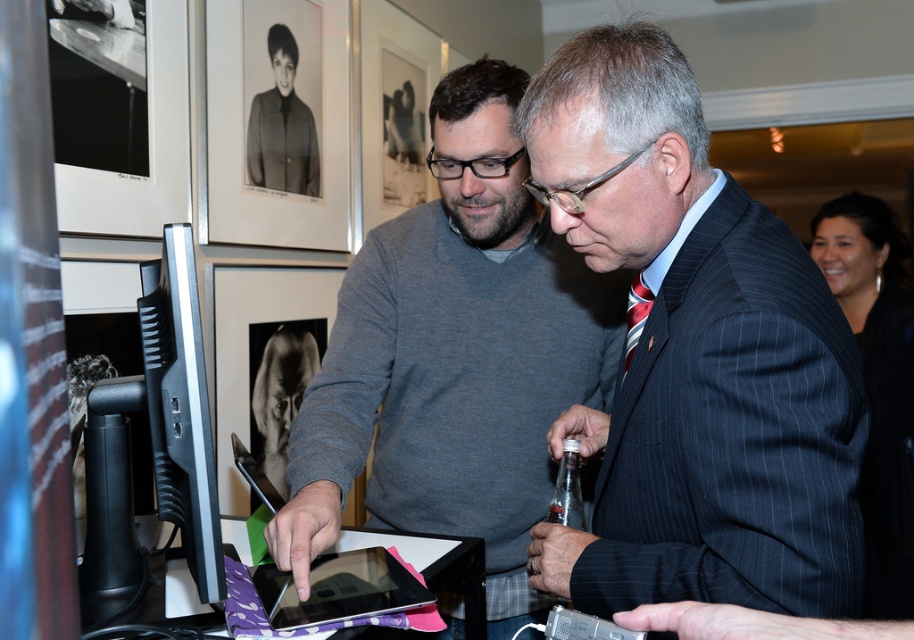
You are organizing a photo shoot and need to ensure that the striped suit at center and the black glossy tablet at center are both visible in the frame. Given that the camera has a fixed focal length, which object should you prioritize positioning closer to the camera to ensure both are in focus?

The striped suit at center is wider than the black glossy tablet at center, so you should prioritize positioning the striped suit at center closer to the camera to ensure both are in focus.

You are a security guard at an event and need to ensure there is enough space between attendees for safety. The minimum required distance between people is 30 inches. Given the distance between the gray sweater at center and the matte black jacket at upper left, can they safely stand that close?

The gray sweater at center is 32.44 inches from the matte black jacket at upper left, which exceeds the minimum required distance of 30 inches. Therefore, they can safely stand that close.

You are a fashion designer observing the scene. You need to determine which clothing item has a greater width for a new collection. Based on the image, which item between the gray sweater at center and the matte black jacket at upper left should you consider for a wider design?

The gray sweater at center has a greater width than the matte black jacket at upper left, so it should be considered for a wider design.